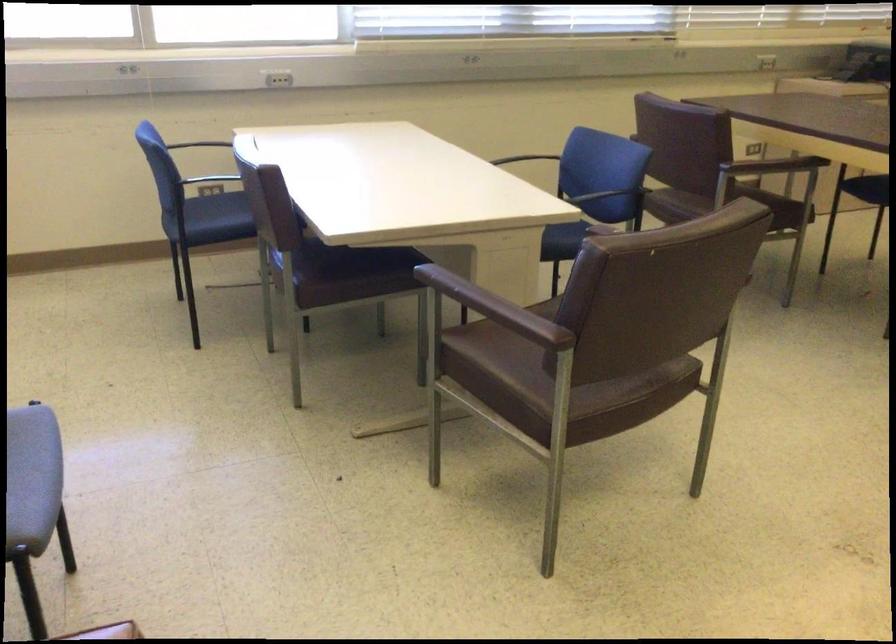
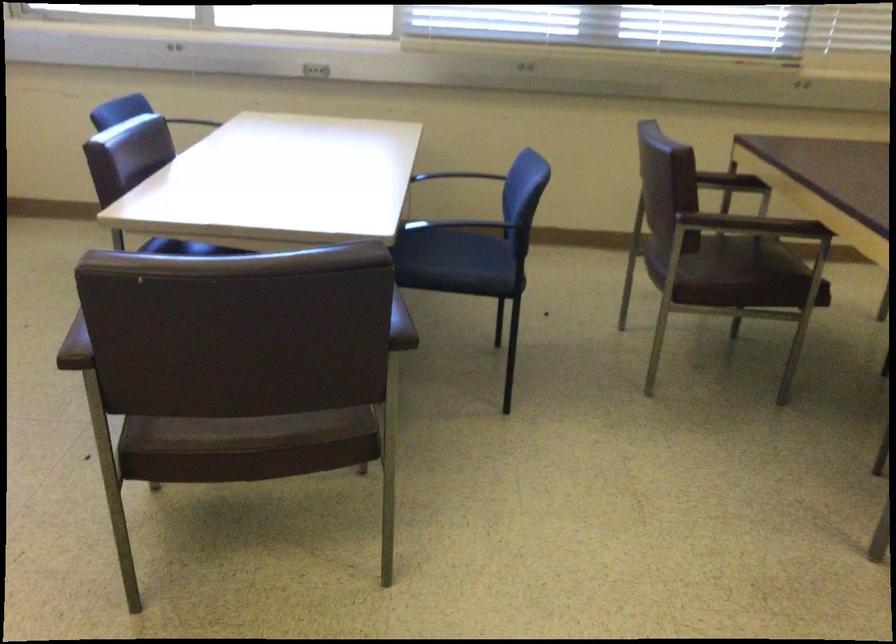
In the second image, find the point that corresponds to point 558,231 in the first image.

(458, 261)